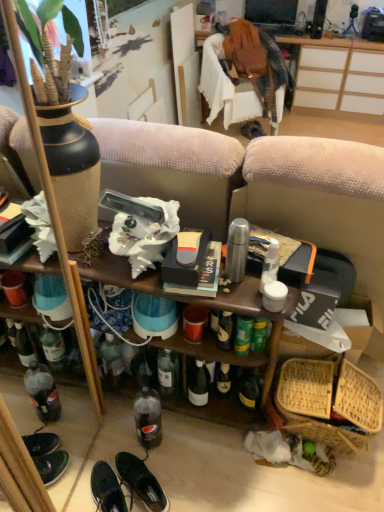
Describe the element at coordinates (148, 417) in the screenshot. I see `clear plastic bottle at lower center` at that location.

Where is `wooden shelf at center`? The width and height of the screenshot is (384, 512). wooden shelf at center is located at coordinates (86, 309).

This screenshot has height=512, width=384. What do you see at coordinates (86, 309) in the screenshot?
I see `wooden shelf at center` at bounding box center [86, 309].

Where is `bamboo woven basket at lower right`? Image resolution: width=384 pixels, height=512 pixels. bamboo woven basket at lower right is located at coordinates (329, 402).

Can you confirm if black leather shoes at lower center, which appears as the 2th footwear when viewed from the left, is shorter than shiny black sneakers at lower left, the second footwear positioned from the right?

Incorrect, the height of black leather shoes at lower center, which appears as the 2th footwear when viewed from the left, does not fall short of that of shiny black sneakers at lower left, the second footwear positioned from the right.

Is black leather shoes at lower center, which appears as the 2th footwear when viewed from the left, bigger or smaller than shiny black sneakers at lower left, the second footwear positioned from the right?

In the image, black leather shoes at lower center, which appears as the 2th footwear when viewed from the left, appears to be smaller than shiny black sneakers at lower left, the second footwear positioned from the right.

Can you tell me how much black leather shoes at lower center, which appears as the 2th footwear when viewed from the left, and shiny black sneakers at lower left, the first footwear when ordered from left to right, differ in facing direction?

3.99 degrees.

Considering the points (151, 504) and (104, 467), which point is in front, point (151, 504) or point (104, 467)?

Positioned in front is point (151, 504).

Would you say clear plastic bottle at lower center is a long distance from wooden desk at upper center?

Yes, clear plastic bottle at lower center and wooden desk at upper center are located far from each other.

Which is behind, clear plastic bottle at lower center or wooden desk at upper center?

wooden desk at upper center is further away from the camera.

Between clear plastic bottle at lower center and wooden desk at upper center, which one has larger size?

wooden desk at upper center.

Which object is closer to the camera, wooden desk at upper center or wooden shelf at center?

wooden shelf at center is closer to the camera.

Does wooden desk at upper center turn towards wooden shelf at center?

Yes, wooden desk at upper center is oriented towards wooden shelf at center.

Can you see wooden desk at upper center touching wooden shelf at center?

No, wooden desk at upper center is not in contact with wooden shelf at center.

Is wooden desk at upper center completely or partially outside of shiny black sneakers at lower left, the second footwear positioned from the right?

wooden desk at upper center lies outside shiny black sneakers at lower left, the second footwear positioned from the right,'s area.

From a real-world perspective, is wooden desk at upper center physically below shiny black sneakers at lower left, the first footwear when ordered from left to right?

No.

Measure the distance from wooden desk at upper center to shiny black sneakers at lower left, the second footwear positioned from the right.

The distance of wooden desk at upper center from shiny black sneakers at lower left, the second footwear positioned from the right, is 12.54 feet.

What's the angular difference between wooden desk at upper center and shiny black sneakers at lower left, the first footwear when ordered from left to right,'s facing directions?

The angular difference between wooden desk at upper center and shiny black sneakers at lower left, the first footwear when ordered from left to right, is 133 degrees.

Is point (153, 484) positioned in front of point (83, 272)?

No.

You are a GUI agent. You are given a task and a screenshot of the screen. Output one action in this format:
    pyautogui.click(x=<x>, y=<y>)
    Task: Click on the shelf on the right of black leather shoes at lower center, marked as the 1th footwear in a right-to-left arrangement
    This screenshot has height=512, width=384.
    Given the screenshot: What is the action you would take?
    pyautogui.click(x=86, y=309)

Is black leather shoes at lower center, which appears as the 2th footwear when viewed from the left, facing away from wooden shelf at center?

No, wooden shelf at center is not at the back of black leather shoes at lower center, which appears as the 2th footwear when viewed from the left.

Is black leather shoes at lower center, which appears as the 2th footwear when viewed from the left, at the left side of wooden shelf at center?

Yes, black leather shoes at lower center, which appears as the 2th footwear when viewed from the left, is to the left of wooden shelf at center.

This screenshot has width=384, height=512. What are the coordinates of `shelf that is under the wooden desk at upper center (from a real-world perspective)` in the screenshot? It's located at (86, 309).

Is wooden shelf at center positioned beyond the bounds of wooden desk at upper center?

wooden shelf at center lies outside wooden desk at upper center's area.

From a real-world perspective, is wooden shelf at center physically located above or below wooden desk at upper center?

From a real-world perspective, wooden shelf at center is physically below wooden desk at upper center.

Based on the photo, considering the positions of objects wooden shelf at center and wooden desk at upper center in the image provided, who is behind, wooden shelf at center or wooden desk at upper center?

wooden desk at upper center is further away from the camera.

How much distance is there between bamboo woven basket at lower right and black leather shoes at lower center, marked as the 1th footwear in a right-to-left arrangement?

64.89 centimeters.

Where is `the 1st footwear in front of the bamboo woven basket at lower right, counting from the anchor's position`? the 1st footwear in front of the bamboo woven basket at lower right, counting from the anchor's position is located at coordinates pyautogui.click(x=141, y=482).

In terms of height, does bamboo woven basket at lower right look taller or shorter compared to black leather shoes at lower center, marked as the 1th footwear in a right-to-left arrangement?

Clearly, bamboo woven basket at lower right is taller compared to black leather shoes at lower center, marked as the 1th footwear in a right-to-left arrangement.

From the picture: Considering the sizes of bamboo woven basket at lower right and black leather shoes at lower center, marked as the 1th footwear in a right-to-left arrangement, in the image, is bamboo woven basket at lower right bigger or smaller than black leather shoes at lower center, marked as the 1th footwear in a right-to-left arrangement,?

In the image, bamboo woven basket at lower right appears to be larger than black leather shoes at lower center, marked as the 1th footwear in a right-to-left arrangement.

Find the location of `footwear behind the shiny black sneakers at lower left, the second footwear positioned from the right`. footwear behind the shiny black sneakers at lower left, the second footwear positioned from the right is located at coordinates (141, 482).

In the image, there is a wooden desk at upper center. At what (x,y) coordinates should I click in order to perform the action: click on bottle below it (from the image's perspective). Please return your answer as a coordinate pair (x, y). The image size is (384, 512). Looking at the image, I should click on (148, 417).

Based on their spatial positions, is shiny black sneakers at lower left, the first footwear when ordered from left to right, or clear plastic bottle at lower center further from wooden desk at upper center?

Among the two, shiny black sneakers at lower left, the first footwear when ordered from left to right, is located further to wooden desk at upper center.

Considering their positions, is wooden shelf at center positioned closer to clear plastic bottle at lower center than shiny black sneakers at lower left, the first footwear when ordered from left to right?

shiny black sneakers at lower left, the first footwear when ordered from left to right, is closer to clear plastic bottle at lower center.

From the image, which object appears to be farther from shiny black sneakers at lower left, the second footwear positioned from the right, black leather shoes at lower center, which appears as the 2th footwear when viewed from the left, or wooden shelf at center?

Among the two, wooden shelf at center is located further to shiny black sneakers at lower left, the second footwear positioned from the right.

Based on their spatial positions, is wooden desk at upper center or bamboo woven basket at lower right further from black leather shoes at lower center, marked as the 1th footwear in a right-to-left arrangement?

wooden desk at upper center.

From the image, which object appears to be farther from black leather shoes at lower center, which appears as the 2th footwear when viewed from the left, wooden desk at upper center or wooden shelf at center?

Based on the image, wooden desk at upper center appears to be further to black leather shoes at lower center, which appears as the 2th footwear when viewed from the left.

Looking at the image, which one is located further to wooden desk at upper center, black leather shoes at lower center, which appears as the 2th footwear when viewed from the left, or clear plastic bottle at lower center?

black leather shoes at lower center, which appears as the 2th footwear when viewed from the left, lies further to wooden desk at upper center than the other object.

From the image, which object appears to be farther from shiny black sneakers at lower left, the second footwear positioned from the right, wooden desk at upper center or clear plastic bottle at lower center?

Among the two, wooden desk at upper center is located further to shiny black sneakers at lower left, the second footwear positioned from the right.

Considering their positions, is bamboo woven basket at lower right positioned closer to black leather shoes at lower center, which appears as the 2th footwear when viewed from the left, than wooden desk at upper center?

The object closer to black leather shoes at lower center, which appears as the 2th footwear when viewed from the left, is bamboo woven basket at lower right.

The height and width of the screenshot is (512, 384). Identify the location of bottle between wooden desk at upper center and shiny black sneakers at lower left, the second footwear positioned from the right, from top to bottom. (148, 417).

This screenshot has height=512, width=384. What are the coordinates of `bottle between wooden shelf at center and wooden desk at upper center along the z-axis` in the screenshot? It's located at (148, 417).

The height and width of the screenshot is (512, 384). Identify the location of footwear between wooden shelf at center and shiny black sneakers at lower left, the second footwear positioned from the right, from top to bottom. (141, 482).

At what (x,y) coordinates should I click in order to perform the action: click on shelf between wooden desk at upper center and black leather shoes at lower center, which appears as the 2th footwear when viewed from the left, in the up-down direction. Please return your answer as a coordinate pair (x, y). This screenshot has height=512, width=384. Looking at the image, I should click on (86, 309).